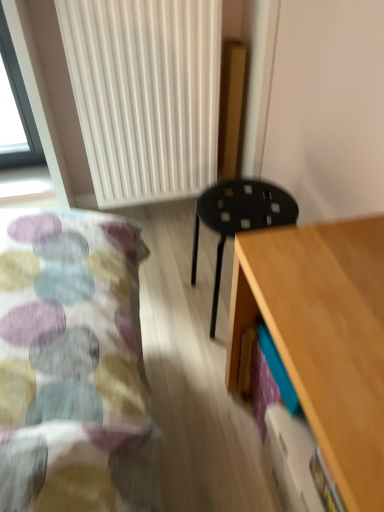
The image size is (384, 512). Describe the element at coordinates (323, 336) in the screenshot. I see `light wood desk at lower right` at that location.

Where is `white ribbed radiator at upper center`? Image resolution: width=384 pixels, height=512 pixels. white ribbed radiator at upper center is located at coordinates (145, 94).

Identify the location of light wood desk at lower right. (323, 336).

Who is shorter, light wood desk at lower right or white ribbed radiator at upper center?

light wood desk at lower right is shorter.

Is point (367, 457) farther from camera compared to point (179, 34)?

That is False.

Which of these two, light wood desk at lower right or white ribbed radiator at upper center, is thinner?

With smaller width is white ribbed radiator at upper center.

Considering the positions of objects black plastic stool at center and white ribbed radiator at upper center in the image provided, who is behind, black plastic stool at center or white ribbed radiator at upper center?

white ribbed radiator at upper center is further from the camera.

Consider the image. Who is bigger, black plastic stool at center or white ribbed radiator at upper center?

Bigger between the two is white ribbed radiator at upper center.

Is black plastic stool at center at the right side of white ribbed radiator at upper center?

Correct, you'll find black plastic stool at center to the right of white ribbed radiator at upper center.

Is point (251, 181) less distant than point (117, 136)?

Yes, it is in front of point (117, 136).

Consider the image. Is light wood desk at lower right behind black plastic stool at center?

No, light wood desk at lower right is closer to the camera.

Considering the relative sizes of light wood desk at lower right and black plastic stool at center in the image provided, is light wood desk at lower right taller than black plastic stool at center?

Yes.

Is light wood desk at lower right situated inside black plastic stool at center or outside?

light wood desk at lower right is not inside black plastic stool at center, it's outside.

Considering the sizes of objects white ribbed radiator at upper center and light wood desk at lower right in the image provided, who is wider, white ribbed radiator at upper center or light wood desk at lower right?

light wood desk at lower right.

The image size is (384, 512). What are the coordinates of `radiator above the light wood desk at lower right (from a real-world perspective)` in the screenshot? It's located at (145, 94).

Considering the points (186, 141) and (310, 415), which point is behind, point (186, 141) or point (310, 415)?

Point (186, 141)

Can you see white ribbed radiator at upper center touching black plastic stool at center?

No, white ribbed radiator at upper center is not making contact with black plastic stool at center.

Is white ribbed radiator at upper center positioned with its back to black plastic stool at center?

That's not correct — white ribbed radiator at upper center is not looking away from black plastic stool at center.

From their relative heights in the image, would you say white ribbed radiator at upper center is taller or shorter than black plastic stool at center?

In the image, white ribbed radiator at upper center appears to be taller than black plastic stool at center.

Looking at this image, considering the sizes of objects black plastic stool at center and light wood desk at lower right in the image provided, who is thinner, black plastic stool at center or light wood desk at lower right?

Thinner between the two is black plastic stool at center.

Based on the photo, from a real-world perspective, is black plastic stool at center physically above light wood desk at lower right?

Actually, black plastic stool at center is physically below light wood desk at lower right in the real world.

Between point (223, 202) and point (324, 454), which one is positioned in front?

The point (324, 454) is closer to the camera.

The image size is (384, 512). What are the coordinates of `desk below the black plastic stool at center (from the image's perspective)` in the screenshot? It's located at (323, 336).

The width and height of the screenshot is (384, 512). Find the location of `desk in front of the white ribbed radiator at upper center`. desk in front of the white ribbed radiator at upper center is located at coordinates (323, 336).

In the image, there is a white ribbed radiator at upper center. Where is `stool below it (from a real-world perspective)`? stool below it (from a real-world perspective) is located at coordinates (239, 218).

Which object lies nearer to the anchor point white ribbed radiator at upper center, black plastic stool at center or light wood desk at lower right?

black plastic stool at center is closer to white ribbed radiator at upper center.

Based on their spatial positions, is light wood desk at lower right or black plastic stool at center closer to white ribbed radiator at upper center?

Among the two, black plastic stool at center is located nearer to white ribbed radiator at upper center.

Based on the photo, estimate the real-world distances between objects in this image. Which object is closer to black plastic stool at center, white ribbed radiator at upper center or light wood desk at lower right?

Among the two, light wood desk at lower right is located nearer to black plastic stool at center.

When comparing their distances from light wood desk at lower right, does white ribbed radiator at upper center or black plastic stool at center seem further?

white ribbed radiator at upper center is positioned further to the anchor light wood desk at lower right.

Considering their positions, is light wood desk at lower right positioned further to black plastic stool at center than white ribbed radiator at upper center?

white ribbed radiator at upper center is further to black plastic stool at center.

Looking at the image, which one is located closer to light wood desk at lower right, black plastic stool at center or white ribbed radiator at upper center?

The object closer to light wood desk at lower right is black plastic stool at center.

The image size is (384, 512). I want to click on stool that lies between white ribbed radiator at upper center and light wood desk at lower right from top to bottom, so click(239, 218).